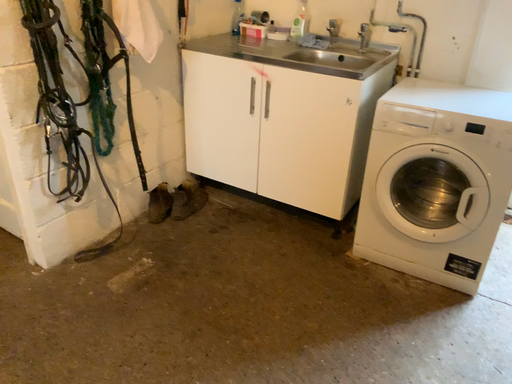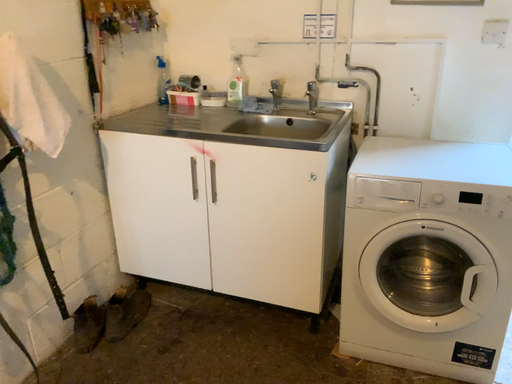
Question: Which way did the camera rotate in the video?

Choices:
 (A) rotated upward
 (B) rotated downward

Answer: (A)